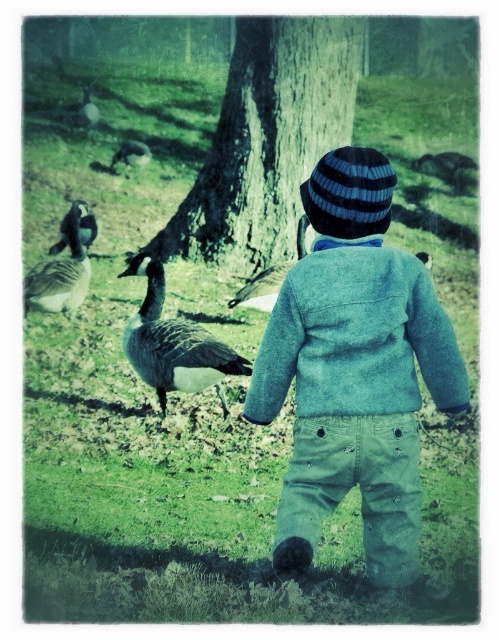
The height and width of the screenshot is (640, 499). What do you see at coordinates (267, 140) in the screenshot?
I see `smooth bark tree at center` at bounding box center [267, 140].

Which of these two, smooth bark tree at center or gray feathered goose at upper left, stands taller?

smooth bark tree at center is taller.

The image size is (499, 640). I want to click on smooth bark tree at center, so click(x=267, y=140).

From the picture: Is gray feathered duck at center smaller than gray feathered duck at upper left?

Correct, gray feathered duck at center occupies less space than gray feathered duck at upper left.

In the scene shown: Does gray feathered duck at center come in front of gray feathered duck at upper left?

Yes, gray feathered duck at center is in front of gray feathered duck at upper left.

I want to click on gray feathered duck at center, so click(x=261, y=288).

Based on the photo, is smooth bark tree at center to the left of gray-feathered duck at center from the viewer's perspective?

Incorrect, smooth bark tree at center is not on the left side of gray-feathered duck at center.

What do you see at coordinates (267, 140) in the screenshot?
I see `smooth bark tree at center` at bounding box center [267, 140].

Measure the distance between point (255,26) and camera.

Point (255,26) is 11.67 meters away from camera.

I want to click on smooth bark tree at center, so click(x=267, y=140).